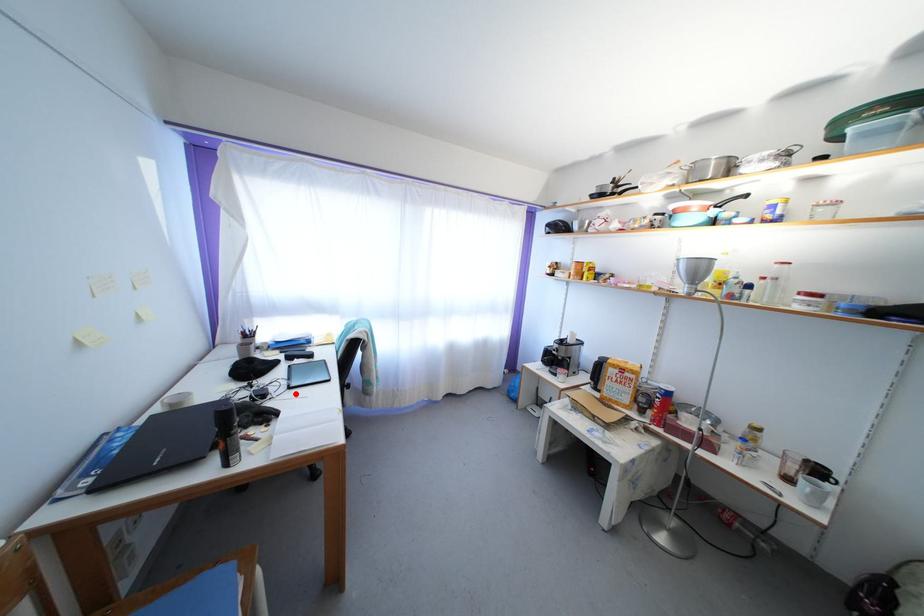
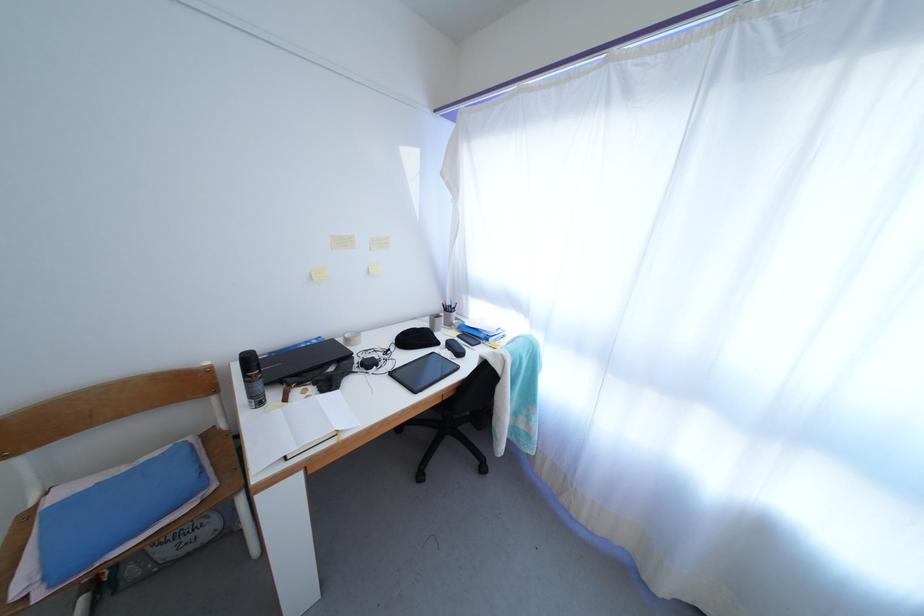
Question: I am providing you with two images of the same scene from different viewpoints. A red point is marked on the first image. At the location where the point appears in image 1, is it still visible in image 2?

Choices:
 (A) Yes
 (B) No

Answer: (A)